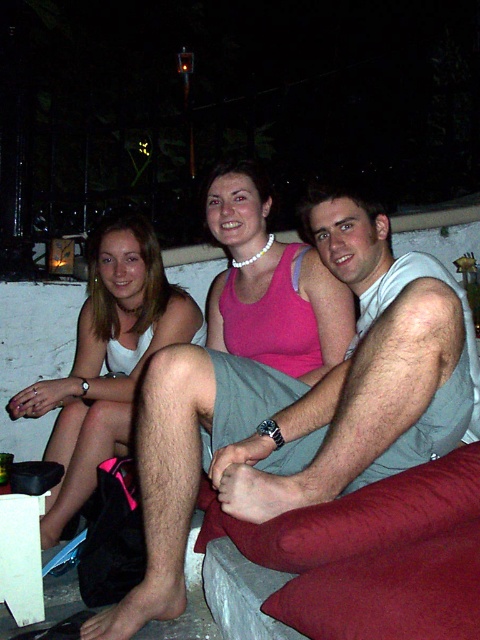
What do you see at coordinates (300, 406) in the screenshot?
I see `gray fabric shorts at center` at bounding box center [300, 406].

Looking at this image, between gray fabric shorts at center and white matte tank top at left, which one appears on the left side from the viewer's perspective?

white matte tank top at left

Does point (263, 420) come behind point (27, 403)?

That is False.

At what (x,y) coordinates should I click in order to perform the action: click on gray fabric shorts at center. Please return your answer as a coordinate pair (x, y). Looking at the image, I should click on (300, 406).